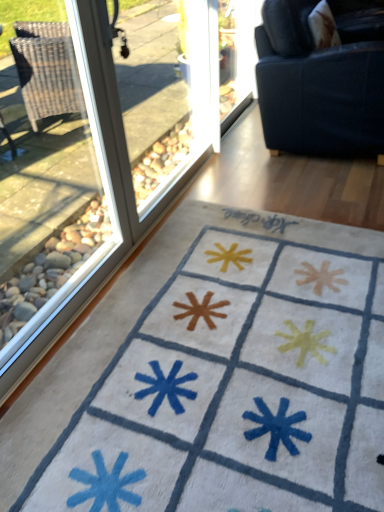
Describe the element at coordinates (322, 77) in the screenshot. I see `dark blue fabric couch at upper right` at that location.

Locate an element on the screen. white soft rug at lower center is located at coordinates click(222, 382).

Considering the relative positions of white soft rug at lower center and transparent glass screen door at upper center in the image provided, is white soft rug at lower center in front of transparent glass screen door at upper center?

Yes, it is.

Is white soft rug at lower center shorter than transparent glass screen door at upper center?

Yes.

From a real-world perspective, is white soft rug at lower center positioned under transparent glass screen door at upper center based on gravity?

Yes.

Could you tell me if white soft rug at lower center is turned towards transparent glass screen door at upper center?

No, white soft rug at lower center does not turn towards transparent glass screen door at upper center.

Considering the relative sizes of transparent glass window at left and dark blue fabric couch at upper right in the image provided, is transparent glass window at left taller than dark blue fabric couch at upper right?

Yes, transparent glass window at left is taller than dark blue fabric couch at upper right.

Considering the sizes of objects transparent glass window at left and dark blue fabric couch at upper right in the image provided, who is thinner, transparent glass window at left or dark blue fabric couch at upper right?

transparent glass window at left.

Is transparent glass window at left facing towards dark blue fabric couch at upper right?

No, transparent glass window at left is not oriented towards dark blue fabric couch at upper right.

Is transparent glass window at left positioned in front of dark blue fabric couch at upper right?

Yes, the depth of transparent glass window at left is less than that of dark blue fabric couch at upper right.

Is transparent glass screen door at upper center oriented away from white soft rug at lower center?

That's not correct — transparent glass screen door at upper center is not looking away from white soft rug at lower center.

From a real-world perspective, which object rests below the other?

white soft rug at lower center.

How many degrees apart are the facing directions of transparent glass screen door at upper center and white soft rug at lower center?

They differ by 89.9 degrees in their facing directions.

Measure the distance between transparent glass screen door at upper center and white soft rug at lower center.

A distance of 3.17 meters exists between transparent glass screen door at upper center and white soft rug at lower center.

Can white soft rug at lower center be found inside transparent glass window at left?

No, white soft rug at lower center is not a part of transparent glass window at left.

Does transparent glass window at left turn towards white soft rug at lower center?

Yes, transparent glass window at left is turned towards white soft rug at lower center.

Which of these two, transparent glass window at left or white soft rug at lower center, stands shorter?

white soft rug at lower center.

In the image, is dark blue fabric couch at upper right on the left side or the right side of transparent glass window at left?

dark blue fabric couch at upper right is positioned on transparent glass window at left's right side.

Is dark blue fabric couch at upper right inside the boundaries of transparent glass window at left, or outside?

The correct answer is: outside.

From the image's perspective, which is above, dark blue fabric couch at upper right or transparent glass window at left?

dark blue fabric couch at upper right.

From the image's perspective, is transparent glass window at left positioned above or below transparent glass screen door at upper center?

Clearly, from the image's perspective, transparent glass window at left is below transparent glass screen door at upper center.

The width and height of the screenshot is (384, 512). Identify the location of screen door behind the transparent glass window at left. (234, 59).

Which object is thinner, transparent glass window at left or transparent glass screen door at upper center?

transparent glass screen door at upper center is thinner.

How different are the orientations of transparent glass window at left and transparent glass screen door at upper center in degrees?

They differ by 0.00102 degrees in their facing directions.

Between white soft rug at lower center and dark blue fabric couch at upper right, which one is positioned behind?

dark blue fabric couch at upper right is behind.

Is white soft rug at lower center located outside dark blue fabric couch at upper right?

white soft rug at lower center is positioned outside dark blue fabric couch at upper right.

Could you tell me if white soft rug at lower center is facing dark blue fabric couch at upper right?

No.

The image size is (384, 512). I want to click on screen door on the right of white soft rug at lower center, so click(234, 59).

The image size is (384, 512). In order to click on window in front of the dark blue fabric couch at upper right in this screenshot , I will do `click(47, 172)`.

Based on their spatial positions, is dark blue fabric couch at upper right or transparent glass screen door at upper center closer to transparent glass window at left?

Among the two, dark blue fabric couch at upper right is located nearer to transparent glass window at left.

From the picture: From the image, which object appears to be nearer to transparent glass screen door at upper center, white soft rug at lower center or dark blue fabric couch at upper right?

dark blue fabric couch at upper right lies closer to transparent glass screen door at upper center than the other object.

From the image, which object appears to be nearer to white soft rug at lower center, transparent glass screen door at upper center or dark blue fabric couch at upper right?

The object closer to white soft rug at lower center is dark blue fabric couch at upper right.

Looking at the image, which one is located further to white soft rug at lower center, dark blue fabric couch at upper right or transparent glass window at left?

Among the two, dark blue fabric couch at upper right is located further to white soft rug at lower center.

Estimate the real-world distances between objects in this image. Which object is closer to transparent glass screen door at upper center, dark blue fabric couch at upper right or white soft rug at lower center?

Among the two, dark blue fabric couch at upper right is located nearer to transparent glass screen door at upper center.

Considering their positions, is transparent glass screen door at upper center positioned closer to dark blue fabric couch at upper right than white soft rug at lower center?

white soft rug at lower center is positioned closer to the anchor dark blue fabric couch at upper right.

When comparing their distances from white soft rug at lower center, does transparent glass window at left or transparent glass screen door at upper center seem further?

transparent glass screen door at upper center lies further to white soft rug at lower center than the other object.

Estimate the real-world distances between objects in this image. Which object is closer to dark blue fabric couch at upper right, transparent glass window at left or transparent glass screen door at upper center?

Based on the image, transparent glass window at left appears to be nearer to dark blue fabric couch at upper right.

You are a GUI agent. You are given a task and a screenshot of the screen. Output one action in this format:
    pyautogui.click(x=<x>, y=<y>)
    Task: Click on the studio couch between transparent glass screen door at upper center and white soft rug at lower center in the up-down direction
    
    Given the screenshot: What is the action you would take?
    pyautogui.click(x=322, y=77)

The width and height of the screenshot is (384, 512). In order to click on studio couch positioned between transparent glass window at left and transparent glass screen door at upper center from near to far in this screenshot , I will do `click(322, 77)`.

I want to click on window that lies between dark blue fabric couch at upper right and white soft rug at lower center from top to bottom, so [x=47, y=172].

This screenshot has width=384, height=512. I want to click on doormat between transparent glass window at left and transparent glass screen door at upper center from front to back, so click(x=222, y=382).